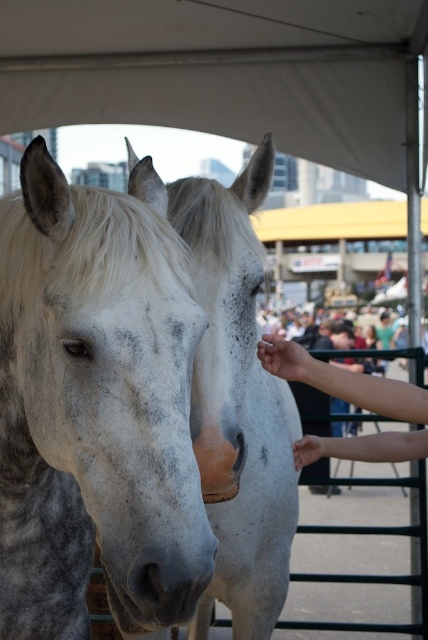
Question: Is white fabric canopy at upper center positioned at the back of white speckled horse at center?

Choices:
 (A) yes
 (B) no

Answer: (A)

Question: Which of the following is the farthest from the observer?

Choices:
 (A) smooth skin hand at center
 (B) speckled white horse at center
 (C) white fabric canopy at upper center
 (D) white speckled horse at center

Answer: (C)

Question: Which point is farther to the camera?

Choices:
 (A) (410, 436)
 (B) (109, 346)
 (C) (23, 38)

Answer: (C)

Question: Which is nearer to the white speckled horse at center?

Choices:
 (A) white fabric canopy at upper center
 (B) speckled white horse at center

Answer: (B)

Question: Is white speckled horse at center to the left of smooth skin hand at center from the viewer's perspective?

Choices:
 (A) no
 (B) yes

Answer: (B)

Question: Is the position of speckled white horse at center more distant than that of white fabric canopy at upper center?

Choices:
 (A) no
 (B) yes

Answer: (A)